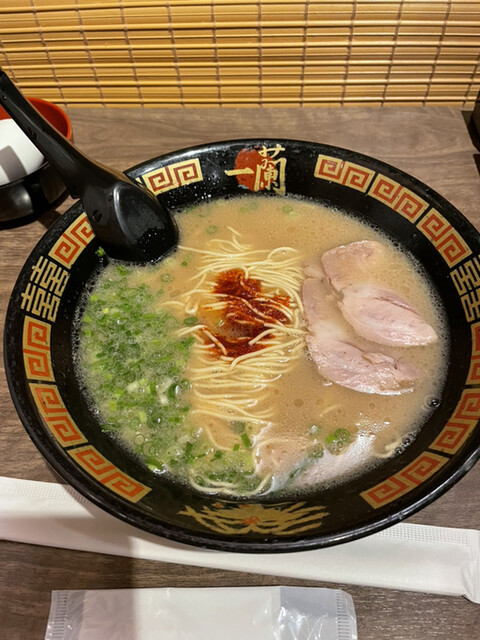
Identify the location of gold characters on the inside rim on the left side of the bowl. The height and width of the screenshot is (640, 480). (52, 276), (46, 303).